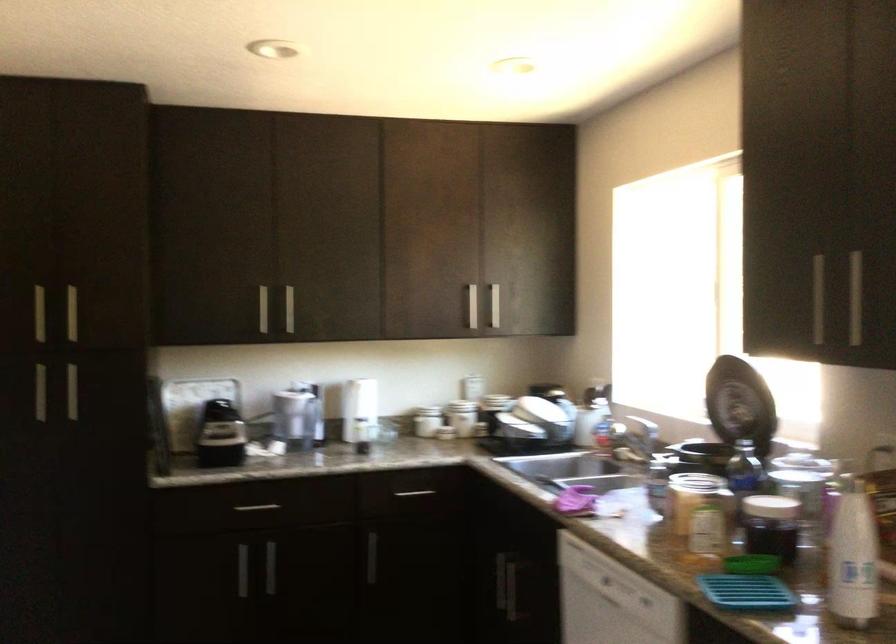
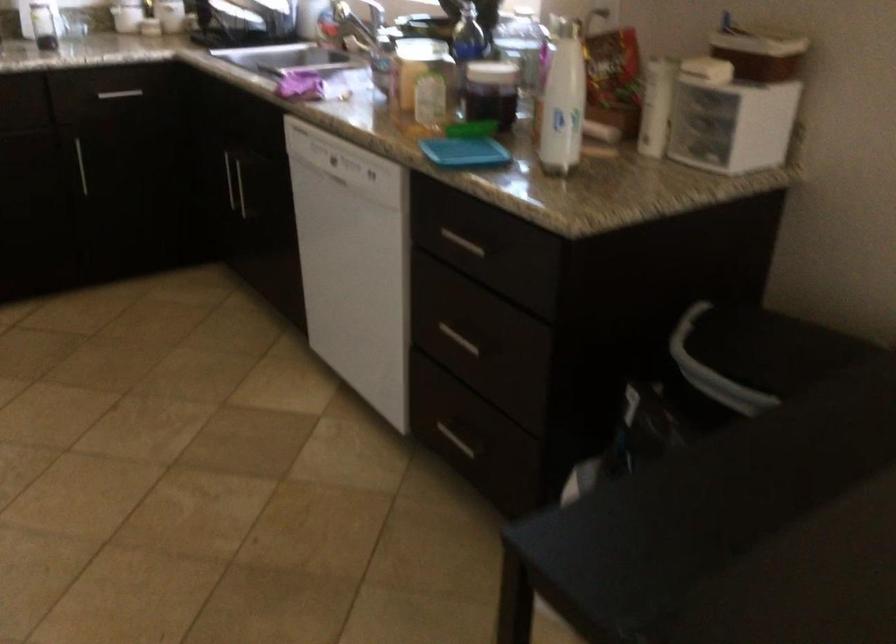
In the second image, find the point that corresponds to point (576, 500) in the first image.

(299, 84)